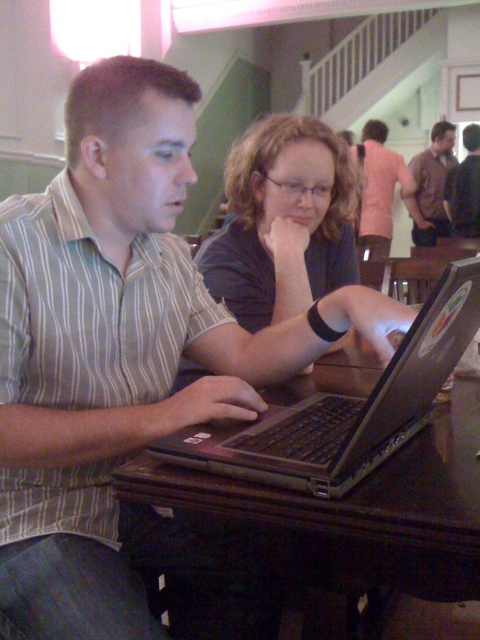
Who is higher up, brown shirt at upper right or brown leather jacket at upper right?

brown shirt at upper right

Between brown shirt at upper right and brown leather jacket at upper right, which one has less height?

Standing shorter between the two is brown leather jacket at upper right.

The width and height of the screenshot is (480, 640). In order to click on brown shirt at upper right in this screenshot , I will do `click(431, 186)`.

Locate an element on the screen. brown shirt at upper right is located at coordinates (431, 186).

Is brown wooden table at center above brown leather jacket at upper right?

Incorrect, brown wooden table at center is not positioned above brown leather jacket at upper right.

Locate an element on the screen. The image size is (480, 640). brown wooden table at center is located at coordinates (352, 513).

The width and height of the screenshot is (480, 640). Find the location of `brown wooden table at center`. brown wooden table at center is located at coordinates (352, 513).

Locate an element on the screen. The height and width of the screenshot is (640, 480). brown wooden table at center is located at coordinates (352, 513).

Between matte black shirt at center and brown shirt at upper right, which one is positioned lower?

Positioned lower is matte black shirt at center.

Does matte black shirt at center appear under brown shirt at upper right?

Indeed, matte black shirt at center is positioned under brown shirt at upper right.

This screenshot has height=640, width=480. I want to click on matte black shirt at center, so click(x=284, y=221).